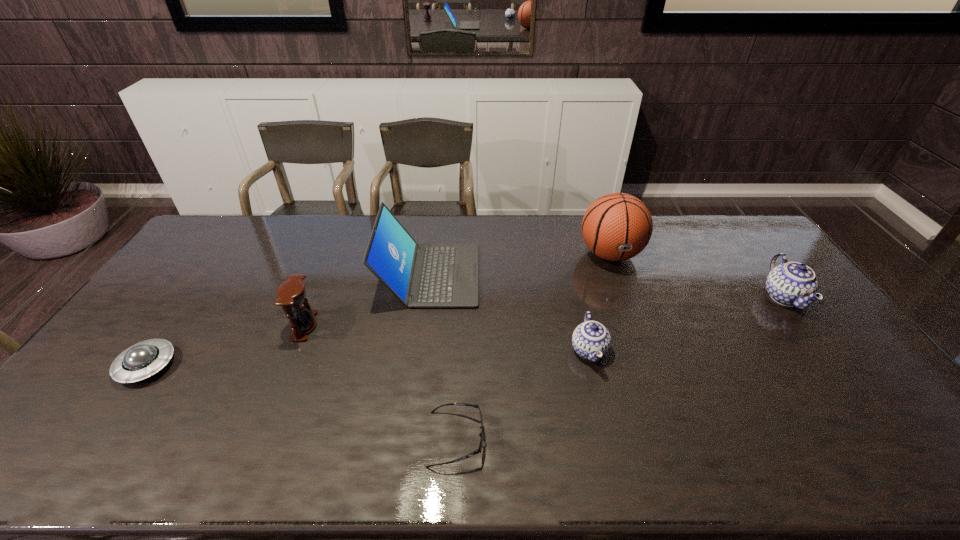
The height and width of the screenshot is (540, 960). What are the coordinates of `basketball at the far edge` in the screenshot? It's located at (618, 226).

Locate an element on the screen. laptop computer at the far edge is located at coordinates (428, 275).

At what (x,y) coordinates should I click in order to perform the action: click on object that is at the near edge. Please return your answer as a coordinate pair (x, y). This screenshot has width=960, height=540. Looking at the image, I should click on (479, 450).

I want to click on object that is at the left edge, so click(140, 361).

Locate an element on the screen. object positioned at the right edge is located at coordinates (790, 284).

Find the location of a particular element. vacant space at the far edge of the desktop is located at coordinates (660, 242).

Identify the location of free spot at the near edge of the desktop. (730, 454).

The image size is (960, 540). In the image, there is a desktop. What are the coordinates of `vacant area at the right edge` in the screenshot? It's located at (864, 369).

Find the location of `vacant area that lies between the farther chinaware and the tallest object`. vacant area that lies between the farther chinaware and the tallest object is located at coordinates (697, 276).

This screenshot has height=540, width=960. In order to click on vacant area that lies between the right chinaware and the sixth tallest object in this screenshot , I will do `click(466, 332)`.